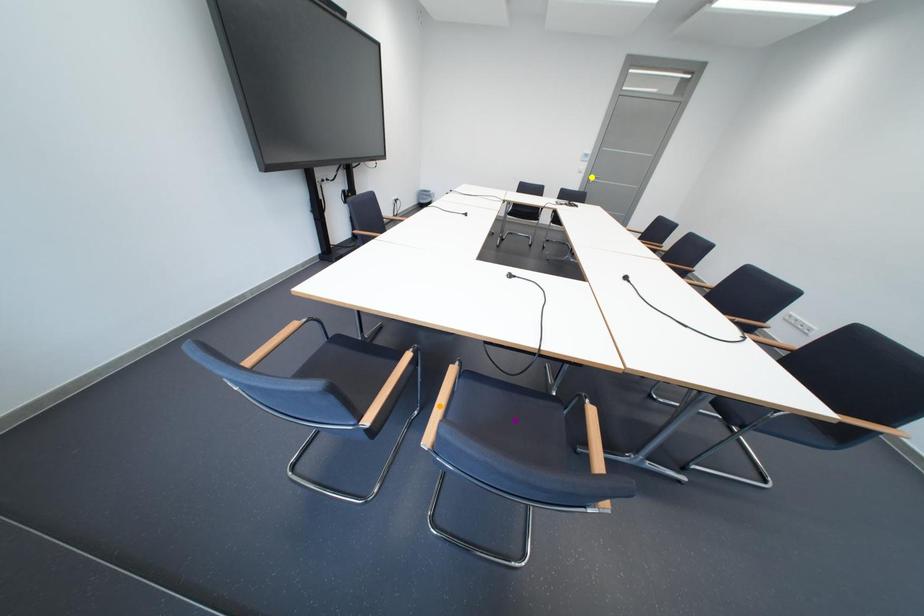
Looking at this image, order these from nearest to farthest:
A) yellow point
B) orange point
C) purple point

orange point, purple point, yellow point